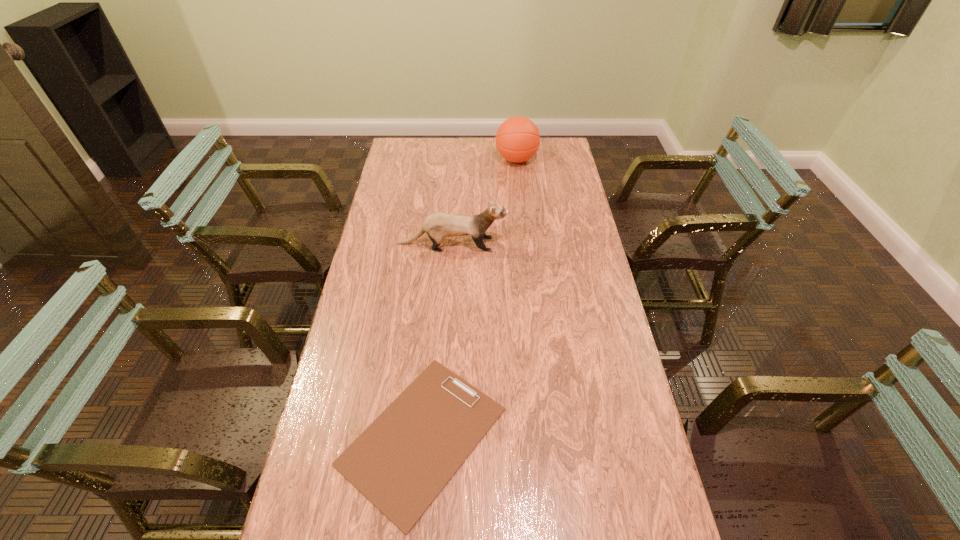
You are a GUI agent. You are given a task and a screenshot of the screen. Output one action in this format:
    pyautogui.click(x=<x>, y=<y>)
    Task: Click on the free region that satisfies the following two spatial constraints: 1. on the back side of the farthest object; 2. on the right side of the shortest object
    
    Given the screenshot: What is the action you would take?
    pyautogui.click(x=448, y=159)

Identify the location of vacant space that satisfies the following two spatial constraints: 1. on the back side of the farthest object; 2. on the left side of the nearest object. (448, 159).

Locate an element on the screen. This screenshot has height=540, width=960. vacant region that satisfies the following two spatial constraints: 1. on the front side of the basketball; 2. on the face of the second farthest object is located at coordinates point(525,244).